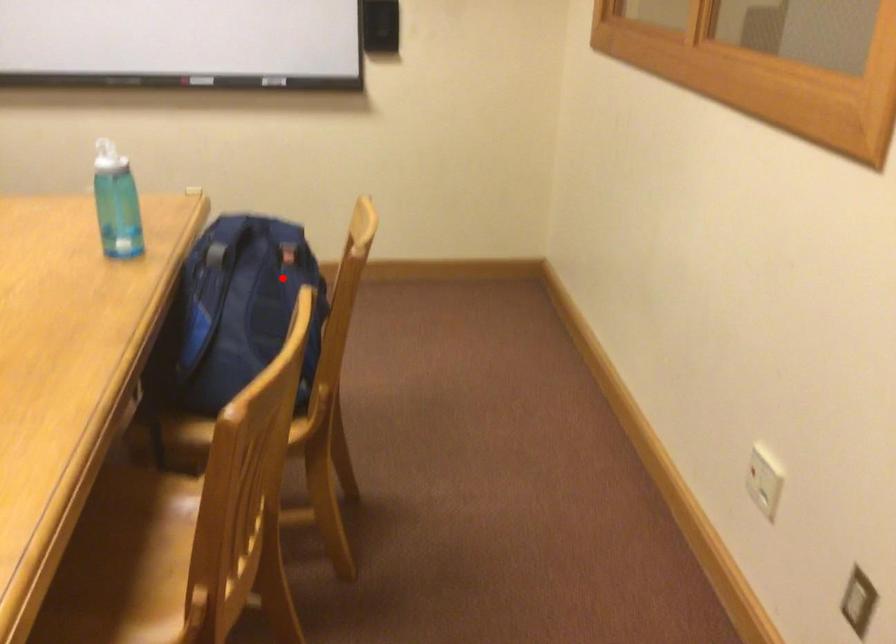
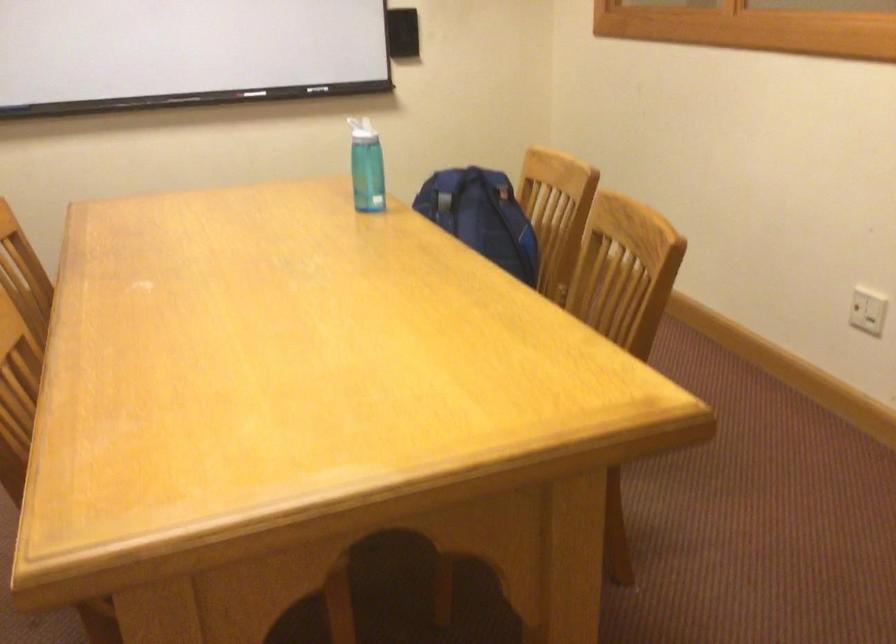
Question: I am providing you with two images of the same scene from different viewpoints. Given a red point in image1, look at the same physical point in image2. Is it:

Choices:
 (A) Closer to the viewpoint
 (B) Farther from the viewpoint

Answer: (B)